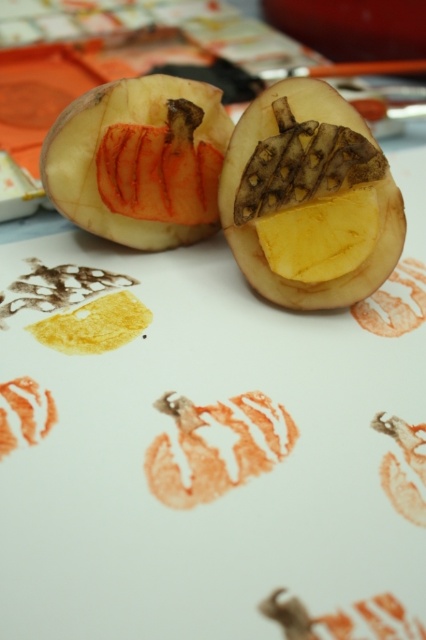
You are organizing a craft station and need to place items in order from closest to farthest from you. Which should come first, the matte orange flesh at center or the orange rubber stamp at lower left?

The matte orange flesh at center should come first because it is closer to you than the orange rubber stamp at lower left.

You are organizing items on a table and need to place a small sticker between the matte orange flesh at center and the orange rubber stamp at lower left. Based on their positions, where should you place the sticker?

The matte orange flesh at center is to the right of the orange rubber stamp at lower left, so you should place the sticker between them on the left side of the matte orange flesh at center and the right side of the orange rubber stamp at lower left.